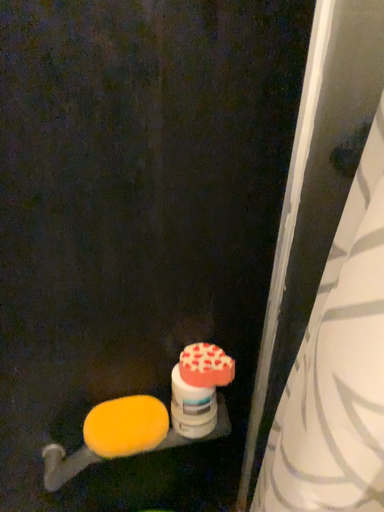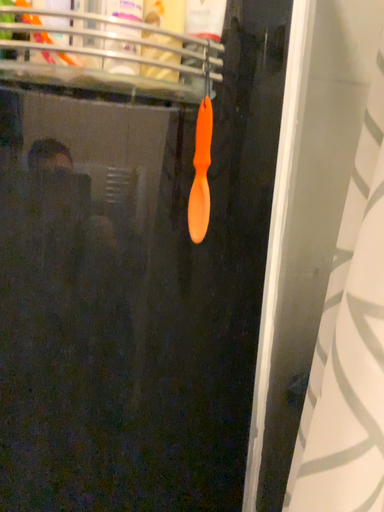
Question: Which way did the camera rotate in the video?

Choices:
 (A) rotated upward
 (B) rotated downward

Answer: (A)